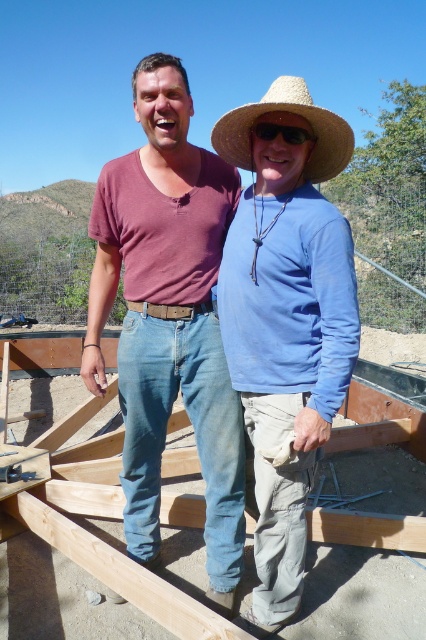
You are a construction supervisor who needs to ensure safety protocols are followed. You notice two workers at the site. The first is wearing a matte brown shirt at center and the second is standing somewhere else. According to safety regulations, workers must maintain a minimum distance of 2 meters apart to avoid overcrowding. Can you confirm if they are compliant with this rule?

The distance between the matte brown shirt at center and the other worker is 2.01 meters, which meets the minimum requirement of 2 meters. Therefore, they are compliant with the safety protocols.